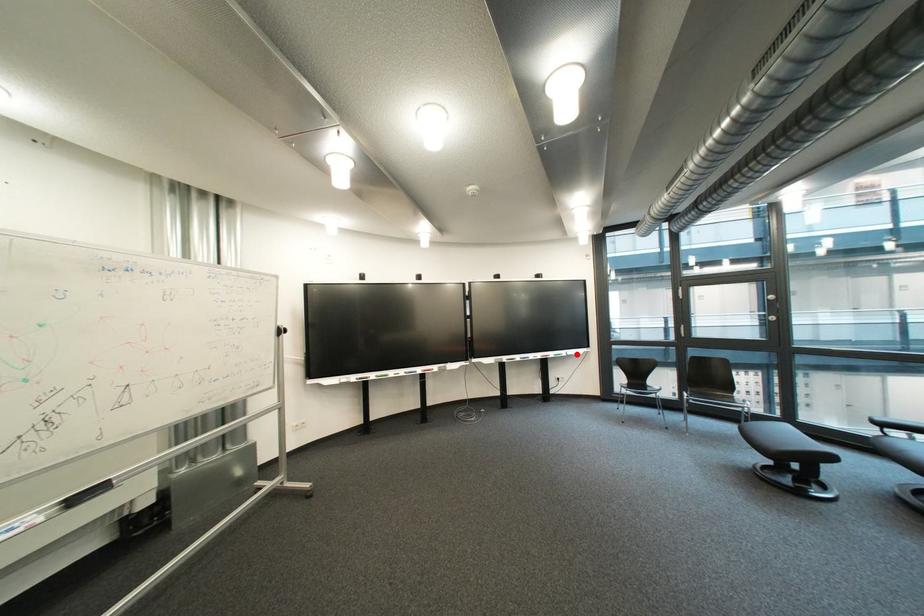
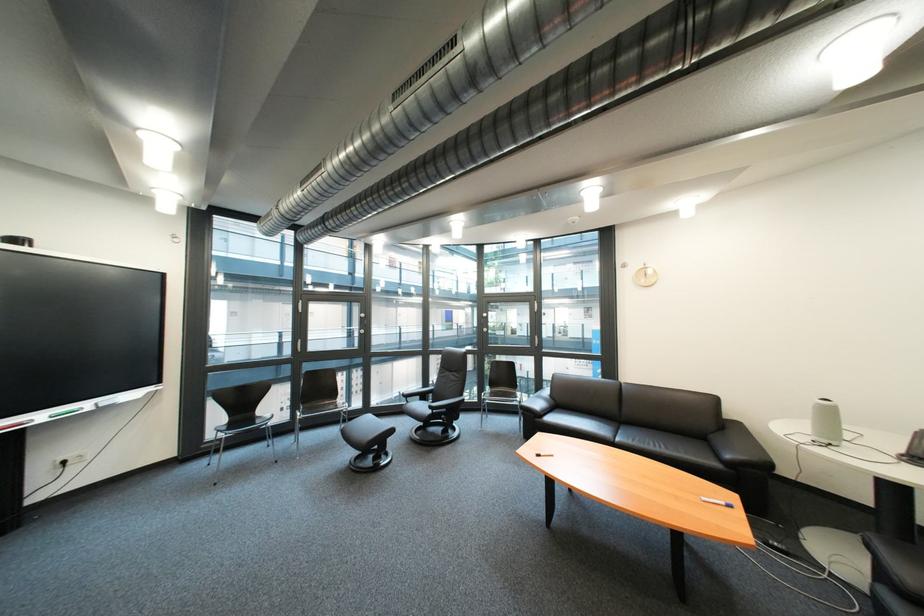
The point at the highlighted location is marked in the first image. Where is the corresponding point in the second image?

(101, 406)